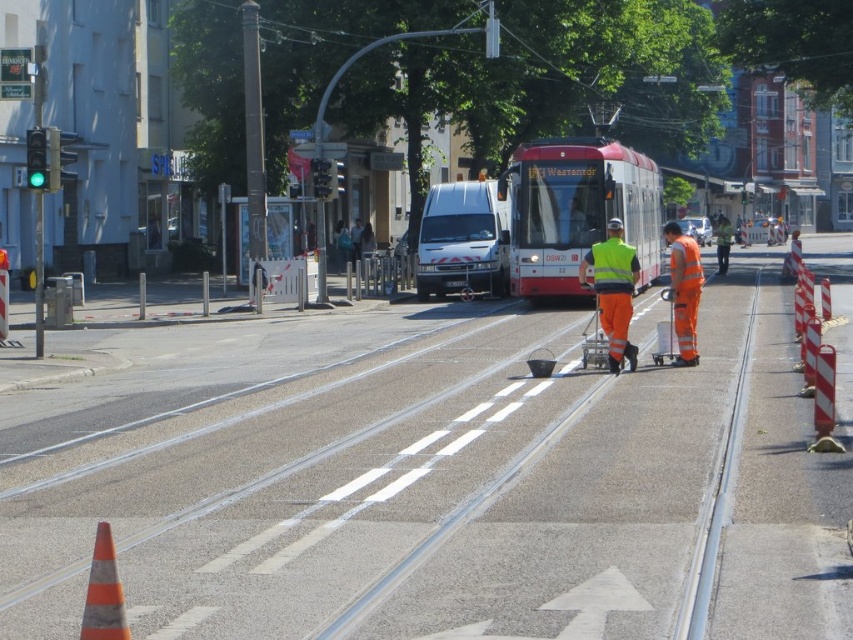
Does orange striped cone at lower left have a greater height compared to yellow reflective safety vest at center?

In fact, orange striped cone at lower left may be shorter than yellow reflective safety vest at center.

Who is more distant from viewer, [97,625] or [605,262]?

The point [605,262] is behind.

Does point (90, 588) lie in front of point (631, 252)?

That is True.

This screenshot has height=640, width=853. Find the location of `orange striped cone at lower left`. orange striped cone at lower left is located at coordinates (103, 593).

Is high visibility orange reflective pants at center to the left of orange reflective workwear at center from the viewer's perspective?

Yes, high visibility orange reflective pants at center is to the left of orange reflective workwear at center.

How much distance is there between high visibility orange reflective pants at center and orange reflective workwear at center?

high visibility orange reflective pants at center is 4.59 meters away from orange reflective workwear at center.

What do you see at coordinates (613, 291) in the screenshot?
I see `high visibility orange reflective pants at center` at bounding box center [613, 291].

This screenshot has width=853, height=640. I want to click on high visibility orange reflective pants at center, so click(x=613, y=291).

Between orange reflective workwear at center and yellow reflective safety vest at center, which one appears on the left side from the viewer's perspective?

From the viewer's perspective, yellow reflective safety vest at center appears more on the left side.

Can you confirm if orange reflective workwear at center is positioned to the right of yellow reflective safety vest at center?

Correct, you'll find orange reflective workwear at center to the right of yellow reflective safety vest at center.

The image size is (853, 640). Describe the element at coordinates (683, 291) in the screenshot. I see `orange reflective workwear at center` at that location.

Locate an element on the screen. Image resolution: width=853 pixels, height=640 pixels. orange reflective workwear at center is located at coordinates tap(683, 291).